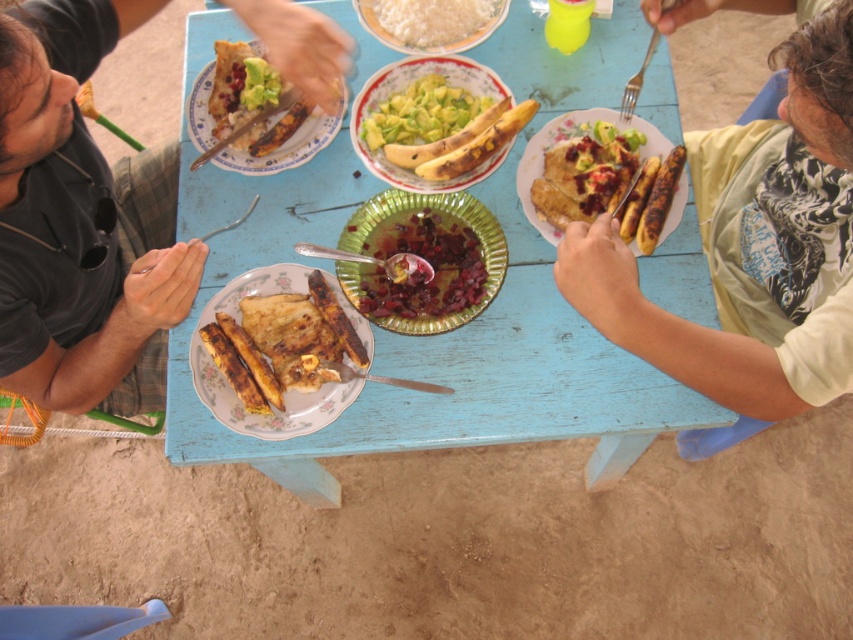
Question: Is the position of shiny metallic bowl at center more distant than that of green matte platter at center?

Choices:
 (A) no
 (B) yes

Answer: (A)

Question: Which point is closer to the camera taking this photo?

Choices:
 (A) [x=426, y=435]
 (B) [x=653, y=134]

Answer: (A)

Question: Which object is the farthest from the light green fabric shirt at upper right?

Choices:
 (A) green matte platter at center
 (B) matte brown plate at center
 (C) blue painted wood table at center
 (D) white matte rice at center

Answer: (D)

Question: Is matte ceramic plate at upper center positioned in front of white matte rice at center?

Choices:
 (A) yes
 (B) no

Answer: (A)

Question: Can you confirm if white matte rice at center is positioned to the right of matte brown plate at center?

Choices:
 (A) yes
 (B) no

Answer: (B)

Question: Which of the following is the closest to the observer?

Choices:
 (A) green matte platter at center
 (B) blue painted wood table at center
 (C) matte ceramic plate at upper center

Answer: (B)